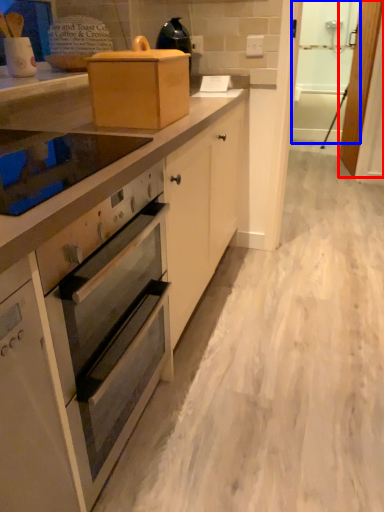
Question: Which object is closer to the camera taking this photo, screen door (highlighted by a red box) or screen door (highlighted by a blue box)?

Choices:
 (A) screen door
 (B) screen door

Answer: (B)